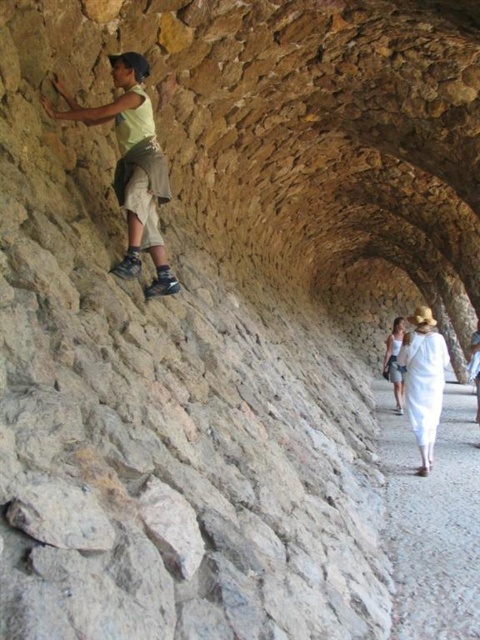
Question: Considering the real-world distances, which object is farthest from the matte yellow shirt at upper left?

Choices:
 (A) white cotton hat at right
 (B) smooth gravel path at lower right

Answer: (A)

Question: Is smooth gravel path at lower right wider than white cotton hat at right?

Choices:
 (A) yes
 (B) no

Answer: (B)

Question: Can you confirm if smooth gravel path at lower right is positioned above matte yellow shirt at upper left?

Choices:
 (A) yes
 (B) no

Answer: (B)

Question: Can you confirm if smooth gravel path at lower right is bigger than white cotton hat at right?

Choices:
 (A) yes
 (B) no

Answer: (B)

Question: Among these points, which one is farthest from the camera?

Choices:
 (A) (424, 493)
 (B) (432, 419)
 (C) (160, 148)

Answer: (B)

Question: Among these objects, which one is nearest to the camera?

Choices:
 (A) matte yellow shirt at upper left
 (B) white cotton hat at right
 (C) smooth gravel path at lower right

Answer: (C)